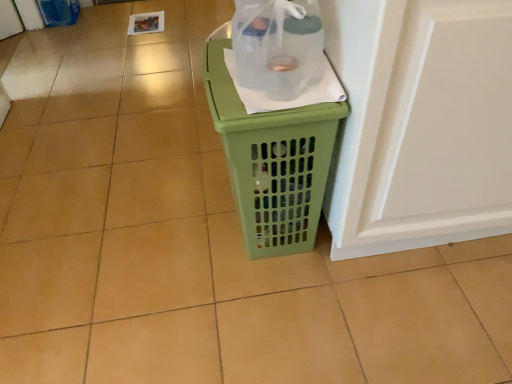
Question: Is transparent plastic bottle at center positioned beyond the bounds of white glossy screen door at right?

Choices:
 (A) yes
 (B) no

Answer: (A)

Question: Is transparent plastic bottle at center closer to the viewer compared to white glossy screen door at right?

Choices:
 (A) yes
 (B) no

Answer: (B)

Question: Does transparent plastic bottle at center appear on the left side of white glossy screen door at right?

Choices:
 (A) no
 (B) yes

Answer: (B)

Question: Does transparent plastic bottle at center have a lesser height compared to white glossy screen door at right?

Choices:
 (A) no
 (B) yes

Answer: (B)

Question: From a real-world perspective, is transparent plastic bottle at center below white glossy screen door at right?

Choices:
 (A) yes
 (B) no

Answer: (B)

Question: From the image's perspective, is transparent plastic bottle at center beneath white glossy screen door at right?

Choices:
 (A) yes
 (B) no

Answer: (B)

Question: Could you tell me if white glossy screen door at right is turned towards transparent plastic bottle at center?

Choices:
 (A) no
 (B) yes

Answer: (A)

Question: Is white glossy screen door at right bigger than transparent plastic bottle at center?

Choices:
 (A) no
 (B) yes

Answer: (B)

Question: From a real-world perspective, is white glossy screen door at right positioned under transparent plastic bottle at center based on gravity?

Choices:
 (A) no
 (B) yes

Answer: (B)

Question: Can you confirm if white glossy screen door at right is thinner than transparent plastic bottle at center?

Choices:
 (A) no
 (B) yes

Answer: (A)

Question: Is white glossy screen door at right wider than transparent plastic bottle at center?

Choices:
 (A) no
 (B) yes

Answer: (B)

Question: Are white glossy screen door at right and transparent plastic bottle at center making contact?

Choices:
 (A) no
 (B) yes

Answer: (A)

Question: Is green plastic laundry basket at center with transparent plastic bottle at center?

Choices:
 (A) yes
 (B) no

Answer: (B)